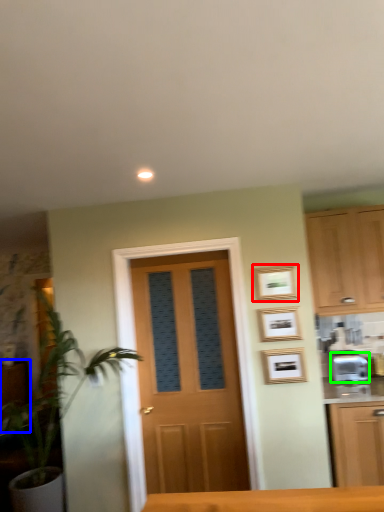
Question: Which object is the farthest from picture frame (highlighted by a red box)? Choose among these: cabinetry (highlighted by a blue box) or appliance (highlighted by a green box).

Choices:
 (A) cabinetry
 (B) appliance

Answer: (A)